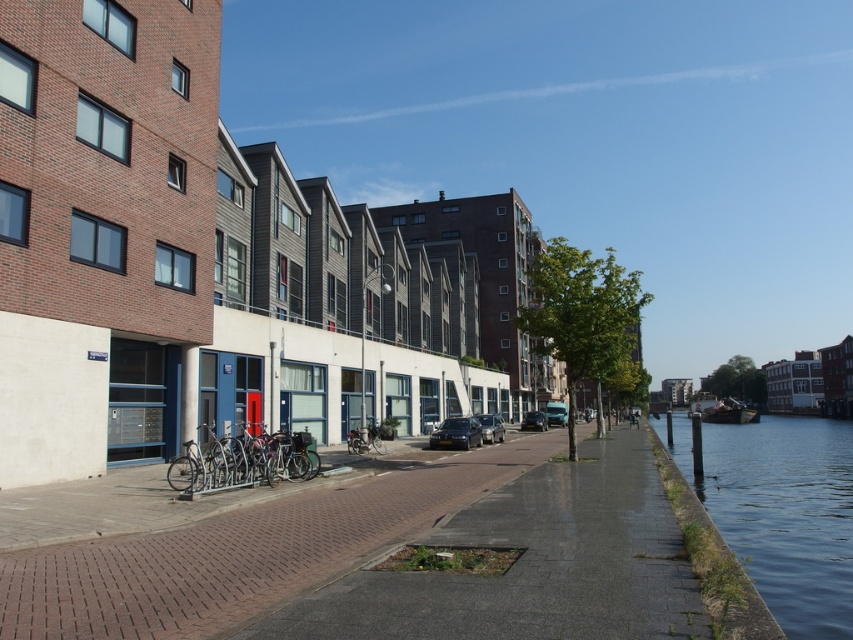
You are a delivery person who needs to unload a package from the shiny black car at center. The silver metallic bicycle at center is blocking the way. Can you move the bicycle to access the car?

The silver metallic bicycle at center is above the shiny black car at center, meaning it is positioned higher up and not directly blocking the car. Therefore, you can access the shiny black car at center without moving the bicycle.